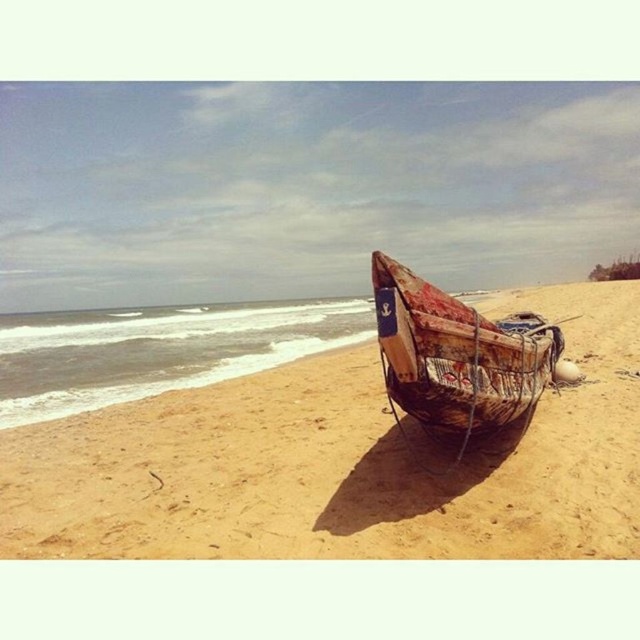
Question: Considering the relative positions of brown sandy beach at center and rusty wooden boat at center in the image provided, where is brown sandy beach at center located with respect to rusty wooden boat at center?

Choices:
 (A) right
 (B) left

Answer: (A)

Question: Is brown sandy beach at center above rusty wooden boat at center?

Choices:
 (A) no
 (B) yes

Answer: (B)

Question: Which object is closer to the camera taking this photo?

Choices:
 (A) rusty wooden boat at center
 (B) brown sandy beach at center

Answer: (A)

Question: Does brown sandy beach at center appear on the right side of rusty wooden boat at center?

Choices:
 (A) yes
 (B) no

Answer: (A)

Question: Which object appears closest to the camera in this image?

Choices:
 (A) rusty wooden boat at center
 (B) brown sandy beach at center

Answer: (A)

Question: Among these objects, which one is farthest from the camera?

Choices:
 (A) rusty wooden boat at center
 (B) brown sandy beach at center

Answer: (B)